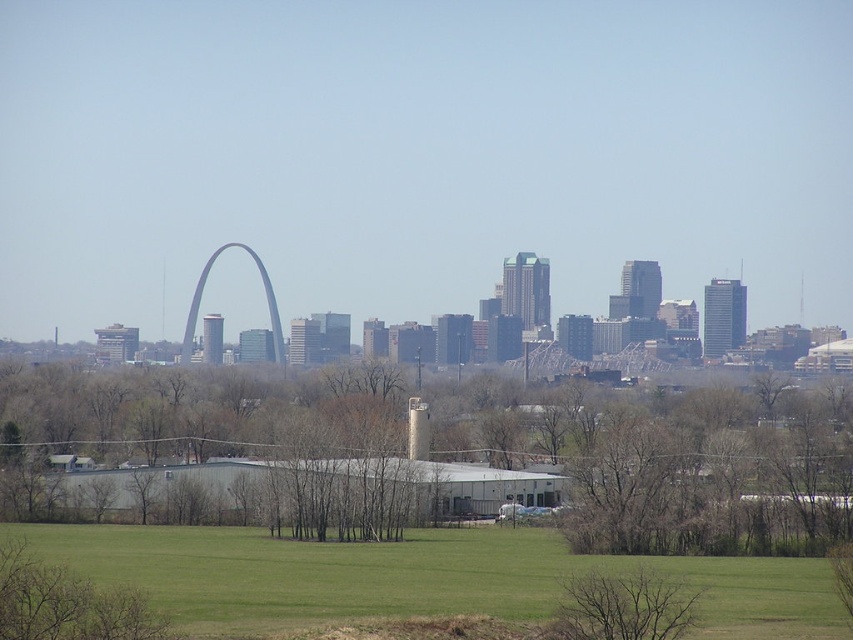
Question: Which of the following is the farthest from the observer?

Choices:
 (A) (51, 554)
 (B) (206, 273)

Answer: (B)

Question: Does green leafy tree at center appear over matte gray arch at center?

Choices:
 (A) no
 (B) yes

Answer: (A)

Question: Can you confirm if green grass at lower center is wider than matte gray arch at center?

Choices:
 (A) yes
 (B) no

Answer: (A)

Question: Which point is closer to the camera?

Choices:
 (A) bare branches at lower center
 (B) green grass at lower center
 (C) green leafy tree at center

Answer: (B)

Question: Which object is farther from the camera taking this photo?

Choices:
 (A) green grass at lower center
 (B) bare branches at lower center
 (C) matte gray arch at center
 (D) green leafy tree at center

Answer: (C)

Question: Can you confirm if green leafy tree at center is thinner than matte gray arch at center?

Choices:
 (A) no
 (B) yes

Answer: (A)